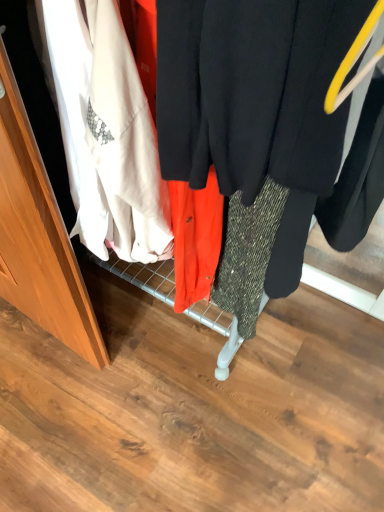
Find the location of a particular element. matte black coat at center is located at coordinates (42, 258).

Describe the element at coordinates (42, 258) in the screenshot. I see `matte black coat at center` at that location.

Locate an element on the screen. This screenshot has width=384, height=512. matte black coat at center is located at coordinates (42, 258).